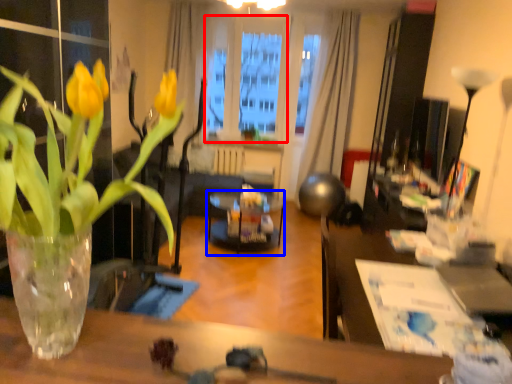
Question: Which point is further to the camera, window screen (highlighted by a red box) or glass table (highlighted by a blue box)?

Choices:
 (A) window screen
 (B) glass table

Answer: (A)